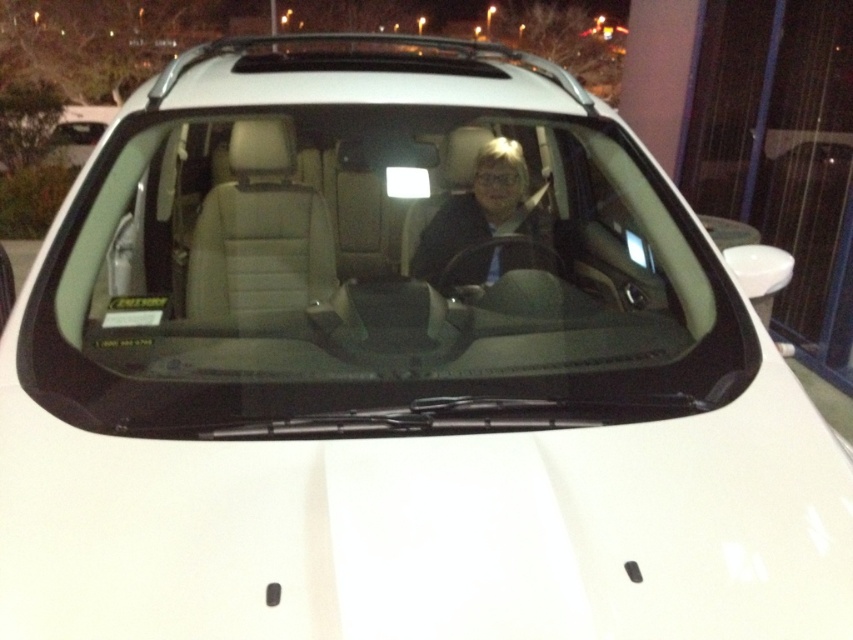
You are a delivery person trying to see if the driver is wearing a jacket inside the car. You can only see the transparent glass windshield at center and the matte black jacket at center. Based on their positions, can you tell which object is closer to the left side of the car?

The transparent glass windshield at center is to the left of the matte black jacket at center, so the transparent glass windshield at center is closer to the left side of the car.

From the picture: You are a delivery person trying to see if the driver is present in the car. You are standing outside the car and looking through the transparent glass windshield at center. Can you see the matte black jacket at center from your position?

The transparent glass windshield at center is located below the matte black jacket at center, so yes, you can see the matte black jacket at center through the windshield from outside the car.

You are a delivery person who needs to place a matte black jacket at center inside a car. The car has a transparent glass windshield at center. Considering the size of the windshield, will the jacket fit through the windshield without folding?

The transparent glass windshield at center is larger in size than the matte black jacket at center, so the jacket can fit through the windshield without needing to be folded.